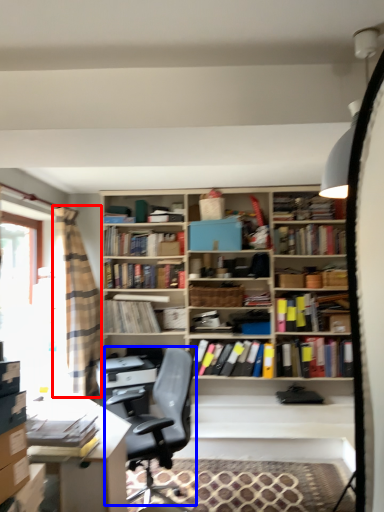
Question: Which point is closer to the camera, curtain (highlighted by a red box) or chair (highlighted by a blue box)?

Choices:
 (A) curtain
 (B) chair

Answer: (B)